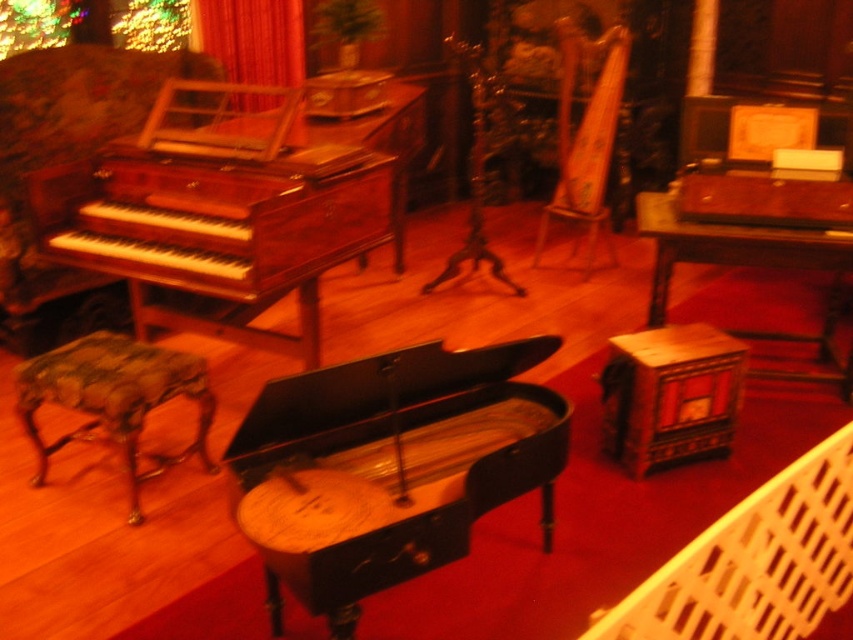
Can you confirm if camouflage fabric stool at lower left is positioned to the right of velvet curtain at upper left?

In fact, camouflage fabric stool at lower left is to the left of velvet curtain at upper left.

Between camouflage fabric stool at lower left and velvet curtain at upper left, which one is positioned lower?

camouflage fabric stool at lower left

Which is in front, point (138, 522) or point (252, 52)?

Point (138, 522) is more forward.

This screenshot has height=640, width=853. I want to click on camouflage fabric stool at lower left, so click(114, 397).

Which of these two, wooden lattice chair at lower right or velvet curtain at upper left, stands taller?

With more height is velvet curtain at upper left.

Who is positioned more to the right, wooden lattice chair at lower right or velvet curtain at upper left?

wooden lattice chair at lower right

Locate an element on the screen. wooden lattice chair at lower right is located at coordinates (755, 563).

The width and height of the screenshot is (853, 640). Identify the location of wooden lattice chair at lower right. (755, 563).

Is black polished piano at center to the left of velvet upholstered armchair at left from the viewer's perspective?

Incorrect, black polished piano at center is not on the left side of velvet upholstered armchair at left.

Between black polished piano at center and velvet upholstered armchair at left, which one appears on the right side from the viewer's perspective?

Positioned to the right is black polished piano at center.

Who is more distant from viewer, (260, 552) or (86, 92)?

Point (86, 92)

The width and height of the screenshot is (853, 640). What are the coordinates of `black polished piano at center` in the screenshot? It's located at (390, 467).